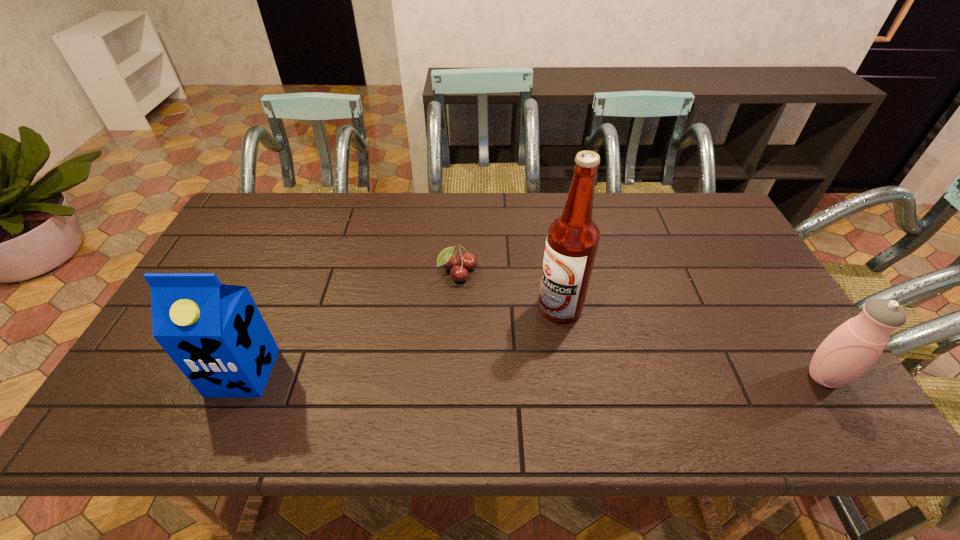
Identify the location of the third shortest object. The image size is (960, 540). (215, 333).

Locate an element on the screen. the leftmost object is located at coordinates (215, 333).

The height and width of the screenshot is (540, 960). I want to click on the rightmost object, so click(x=854, y=346).

Locate an element on the screen. the second shortest object is located at coordinates (854, 346).

Find the location of a particular element. The width and height of the screenshot is (960, 540). the second object from right to left is located at coordinates (572, 241).

This screenshot has width=960, height=540. Identify the location of alcohol. (572, 241).

The height and width of the screenshot is (540, 960). I want to click on the shortest object, so click(x=467, y=261).

Where is `the third object from right to left`? Image resolution: width=960 pixels, height=540 pixels. the third object from right to left is located at coordinates (467, 261).

Image resolution: width=960 pixels, height=540 pixels. I want to click on free space located 0.400m on the back of the thermos bottle, so click(744, 252).

Find the location of a particular element. The height and width of the screenshot is (540, 960). free spot located on the label side of the alcohol is located at coordinates (462, 394).